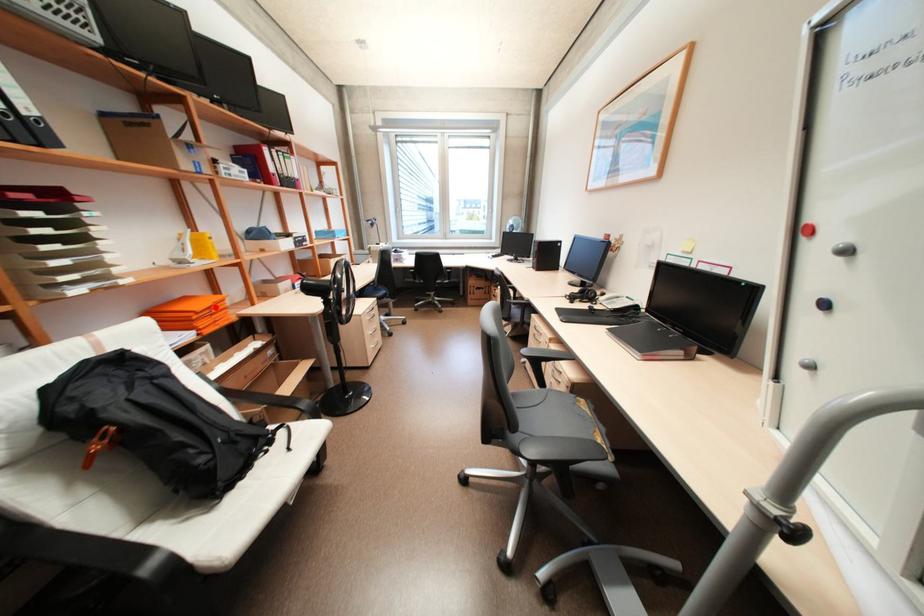
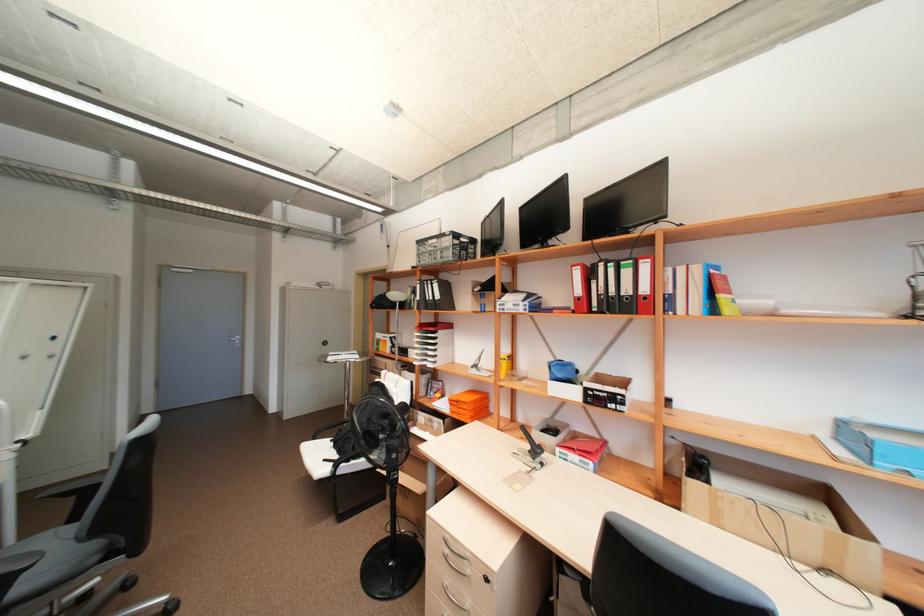
The point at the highlighted location is marked in the first image. Where is the corresponding point in the second image?

(463, 400)